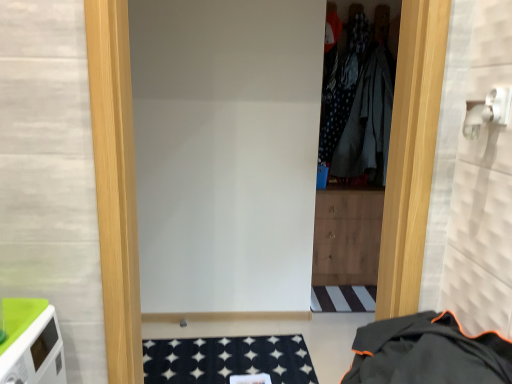
Question: Is dark grey fabric at center, acting as the second clothing starting from the bottom, smaller than black fabric jacket at lower right, the second clothing when ordered from back to front?

Choices:
 (A) yes
 (B) no

Answer: (A)

Question: Is the position of dark grey fabric at center, the first clothing positioned from the back, less distant than that of black fabric jacket at lower right, the second clothing when ordered from back to front?

Choices:
 (A) yes
 (B) no

Answer: (B)

Question: Is the surface of dark grey fabric at center, the 2th clothing from the front, in direct contact with black fabric jacket at lower right, marked as the 2th clothing in a top-to-bottom arrangement?

Choices:
 (A) yes
 (B) no

Answer: (B)

Question: Is dark grey fabric at center, acting as the second clothing starting from the bottom, to the left of black fabric jacket at lower right, the 1th clothing viewed from the front, from the viewer's perspective?

Choices:
 (A) yes
 (B) no

Answer: (B)

Question: Is dark grey fabric at center, the first clothing positioned from the back, to the right of black fabric jacket at lower right, the 1th clothing viewed from the front, from the viewer's perspective?

Choices:
 (A) no
 (B) yes

Answer: (B)

Question: From a real-world perspective, is dark grey fabric at center, the 1th clothing in the top-to-bottom sequence, physically above black fabric jacket at lower right, the 1th clothing in the bottom-to-top sequence?

Choices:
 (A) no
 (B) yes

Answer: (B)

Question: Considering the relative positions of white matte door at center and dark grey fabric at center, the 2th clothing from the front, in the image provided, is white matte door at center to the left of dark grey fabric at center, the 2th clothing from the front, from the viewer's perspective?

Choices:
 (A) no
 (B) yes

Answer: (B)

Question: Is white matte door at center smaller than dark grey fabric at center, the 2th clothing from the front?

Choices:
 (A) no
 (B) yes

Answer: (A)

Question: From a real-world perspective, does white matte door at center sit lower than dark grey fabric at center, the 1th clothing in the top-to-bottom sequence?

Choices:
 (A) yes
 (B) no

Answer: (A)

Question: Is white matte door at center facing away from dark grey fabric at center, the first clothing positioned from the back?

Choices:
 (A) yes
 (B) no

Answer: (A)

Question: From a real-world perspective, is white matte door at center on top of dark grey fabric at center, acting as the second clothing starting from the bottom?

Choices:
 (A) no
 (B) yes

Answer: (A)

Question: Is white matte door at center shorter than dark grey fabric at center, the 2th clothing from the front?

Choices:
 (A) no
 (B) yes

Answer: (A)

Question: Does black fabric jacket at lower right, the second clothing when ordered from back to front, have a greater width compared to dark grey fabric at center, the 1th clothing in the top-to-bottom sequence?

Choices:
 (A) no
 (B) yes

Answer: (B)